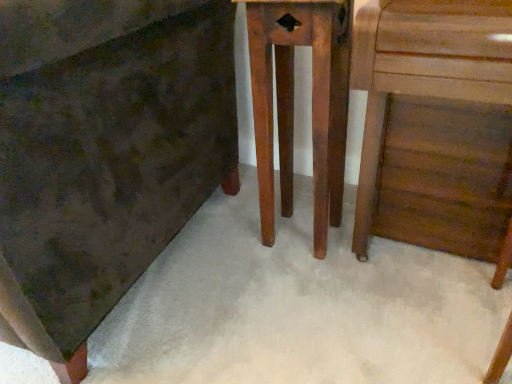
Locate an element on the screen. This screenshot has width=512, height=384. free area behind wooden table at center is located at coordinates (278, 196).